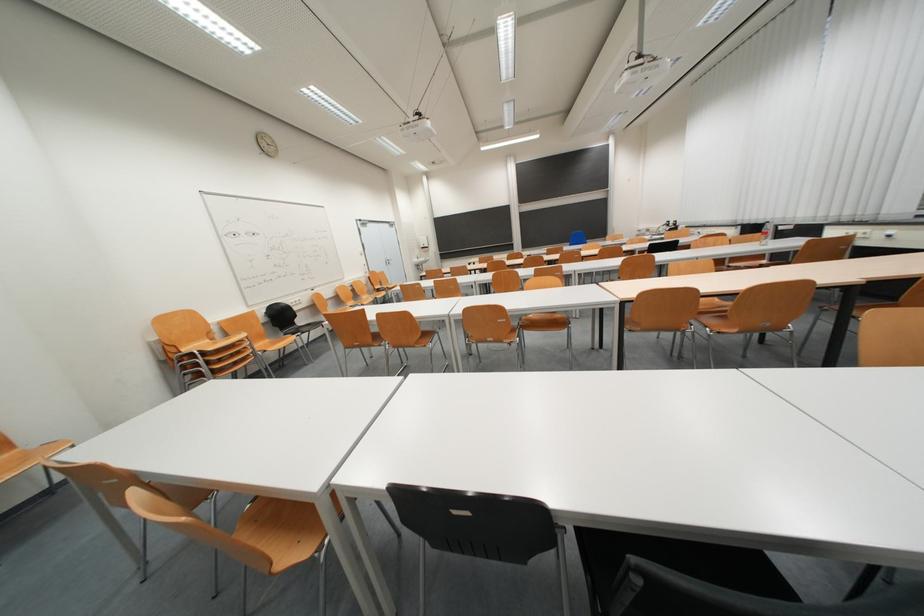
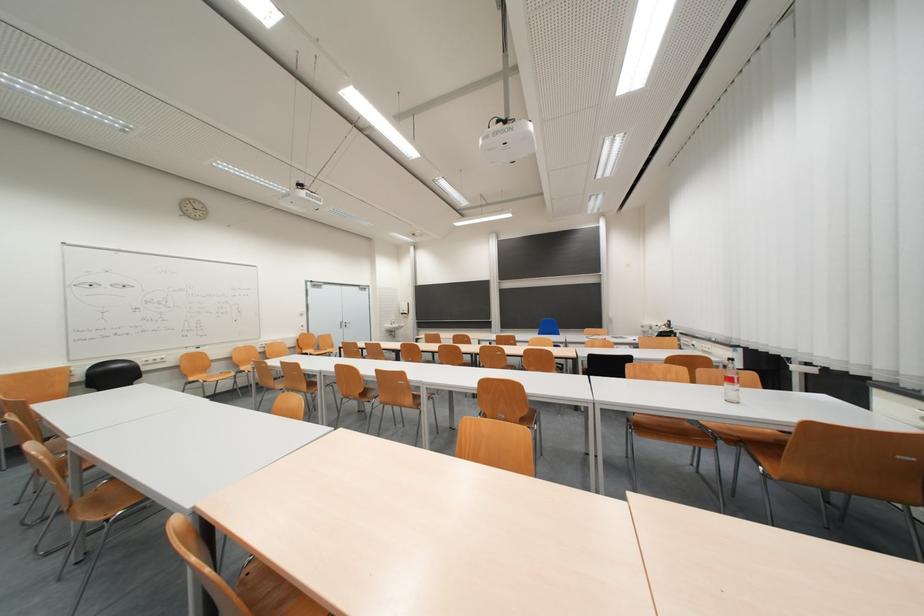
In a continuous first-person perspective shot, in which direction is the camera moving?

The cameraman moved toward right, forward.